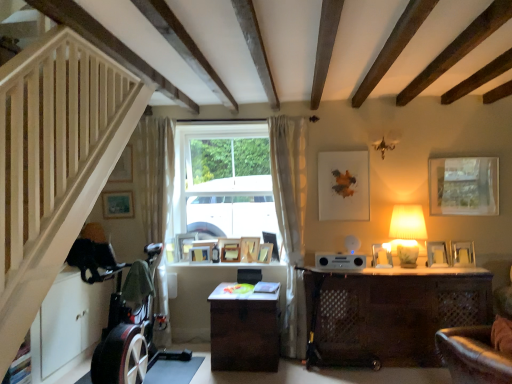
What do you see at coordinates (382, 255) in the screenshot? This screenshot has width=512, height=384. I see `matte silver picture frame at right, placed as the eighth picture frame when sorted from left to right` at bounding box center [382, 255].

Measure the distance between point (252, 260) and camera.

Point (252, 260) and camera are 14.62 feet apart from each other.

The height and width of the screenshot is (384, 512). Find the location of `wooden photo frame at center, the fifth picture frame in the right-to-left sequence`. wooden photo frame at center, the fifth picture frame in the right-to-left sequence is located at coordinates click(249, 249).

The image size is (512, 384). I want to click on matte gold picture frame at upper left, placed as the tenth picture frame when sorted from right to left, so click(123, 167).

The height and width of the screenshot is (384, 512). What do you see at coordinates (463, 254) in the screenshot? I see `metallic reflective picture frame at right, which is counted as the first picture frame, starting from the right` at bounding box center [463, 254].

The height and width of the screenshot is (384, 512). Describe the element at coordinates (389, 314) in the screenshot. I see `dark wood desk at center` at that location.

Image resolution: width=512 pixels, height=384 pixels. I want to click on white fabric lampshade at right, so click(x=407, y=232).

Where is `matte silver picture frame at right, placed as the eighth picture frame when sorted from left to right`? The image size is (512, 384). matte silver picture frame at right, placed as the eighth picture frame when sorted from left to right is located at coordinates (382, 255).

Does metallic reflective picture frame at right, positioned as the 10th picture frame in left-to-right order, have a lesser height compared to matte gold picture frame at upper left, positioned as the first picture frame in left-to-right order?

Yes, metallic reflective picture frame at right, positioned as the 10th picture frame in left-to-right order, is shorter than matte gold picture frame at upper left, positioned as the first picture frame in left-to-right order.

Measure the distance between metallic reflective picture frame at right, positioned as the 10th picture frame in left-to-right order, and matte gold picture frame at upper left, positioned as the first picture frame in left-to-right order.

A distance of 3.38 meters exists between metallic reflective picture frame at right, positioned as the 10th picture frame in left-to-right order, and matte gold picture frame at upper left, positioned as the first picture frame in left-to-right order.

Is metallic reflective picture frame at right, which is counted as the first picture frame, starting from the right, positioned with its back to matte gold picture frame at upper left, positioned as the first picture frame in left-to-right order?

No, matte gold picture frame at upper left, positioned as the first picture frame in left-to-right order, is not at the back of metallic reflective picture frame at right, which is counted as the first picture frame, starting from the right.

Considering the positions of points (459, 257) and (132, 168), is point (459, 257) closer to camera compared to point (132, 168)?

That is True.

Which picture frame is the 2nd one when counting from the back of the matte gold picture frame at upper left, positioned as the first picture frame in left-to-right order? Please provide its 2D coordinates.

[(249, 249)]

From a real-world perspective, is wooden photo frame at center, the 6th picture frame viewed from the left, under matte gold picture frame at upper left, placed as the tenth picture frame when sorted from right to left?

Yes.

Can you confirm if wooden photo frame at center, the fifth picture frame in the right-to-left sequence, is wider than matte gold picture frame at upper left, positioned as the first picture frame in left-to-right order?

Correct, the width of wooden photo frame at center, the fifth picture frame in the right-to-left sequence, exceeds that of matte gold picture frame at upper left, positioned as the first picture frame in left-to-right order.

Can you tell me how much wooden photo frame at center, the fifth picture frame in the right-to-left sequence, and matte gold picture frame at upper left, placed as the tenth picture frame when sorted from right to left, differ in facing direction?

wooden photo frame at center, the fifth picture frame in the right-to-left sequence, and matte gold picture frame at upper left, placed as the tenth picture frame when sorted from right to left, are facing 12.5 degrees away from each other.

Does point (201, 254) lie behind point (443, 247)?

Yes, point (201, 254) is behind point (443, 247).

Measure the distance between wooden picture frame at center, arranged as the 4th picture frame when viewed from the left, and silver metallic picture frame at right, positioned as the 9th picture frame in left-to-right order.

They are 2.28 meters apart.

Between wooden picture frame at center, arranged as the 4th picture frame when viewed from the left, and silver metallic picture frame at right, positioned as the 9th picture frame in left-to-right order, which one is positioned behind?

wooden picture frame at center, arranged as the 4th picture frame when viewed from the left.

Which object is positioned more to the left, wooden picture frame at center, placed as the seventh picture frame when sorted from right to left, or silver metallic picture frame at right, positioned as the 9th picture frame in left-to-right order?

wooden picture frame at center, placed as the seventh picture frame when sorted from right to left, is more to the left.

From the picture: Considering the sizes of objects silver metallic picture frame at right, positioned as the 9th picture frame in left-to-right order, and wooden picture frame at center, the fifth picture frame when ordered from left to right, in the image provided, who is bigger, silver metallic picture frame at right, positioned as the 9th picture frame in left-to-right order, or wooden picture frame at center, the fifth picture frame when ordered from left to right,?

Bigger between the two is silver metallic picture frame at right, positioned as the 9th picture frame in left-to-right order.

Is silver metallic picture frame at right, positioned as the 9th picture frame in left-to-right order, far away from wooden picture frame at center, which is counted as the 6th picture frame, starting from the right?

Yes, silver metallic picture frame at right, positioned as the 9th picture frame in left-to-right order, and wooden picture frame at center, which is counted as the 6th picture frame, starting from the right, are quite far apart.

Does silver metallic picture frame at right, positioned as the 9th picture frame in left-to-right order, have a greater height compared to wooden picture frame at center, which is counted as the 6th picture frame, starting from the right?

Correct, silver metallic picture frame at right, positioned as the 9th picture frame in left-to-right order, is much taller as wooden picture frame at center, which is counted as the 6th picture frame, starting from the right.

Is silver metallic picture frame at right, positioned as the 9th picture frame in left-to-right order, turned away from wooden picture frame at center, the fifth picture frame when ordered from left to right?

silver metallic picture frame at right, positioned as the 9th picture frame in left-to-right order, does not have its back to wooden picture frame at center, the fifth picture frame when ordered from left to right.

In the scene shown: How distant is wooden picture frame at center, which ranks as the 3th picture frame in left-to-right order, from dark wood desk at center?

They are 2.06 meters apart.

The width and height of the screenshot is (512, 384). In order to click on desk lying on the right of wooden picture frame at center, arranged as the 8th picture frame when viewed from the right in this screenshot , I will do `click(389, 314)`.

How many degrees apart are the facing directions of wooden picture frame at center, which ranks as the 3th picture frame in left-to-right order, and dark wood desk at center?

The facing directions of wooden picture frame at center, which ranks as the 3th picture frame in left-to-right order, and dark wood desk at center are 35.9 degrees apart.

Is wooden picture frame at center, which ranks as the 3th picture frame in left-to-right order, positioned far away from dark wood desk at center?

That's right, there is a large distance between wooden picture frame at center, which ranks as the 3th picture frame in left-to-right order, and dark wood desk at center.

Can you confirm if white fabric lampshade at right is positioned to the right of metallic reflective picture frame at right, positioned as the 10th picture frame in left-to-right order?

In fact, white fabric lampshade at right is to the left of metallic reflective picture frame at right, positioned as the 10th picture frame in left-to-right order.

Find the location of a particular element. Image resolution: width=512 pixels, height=384 pixels. the 3rd picture frame directly beneath the white fabric lampshade at right (from a real-world perspective) is located at coordinates (463, 254).

In the scene shown: Measure the distance between white fabric lampshade at right and metallic reflective picture frame at right, which is counted as the first picture frame, starting from the right.

white fabric lampshade at right and metallic reflective picture frame at right, which is counted as the first picture frame, starting from the right, are 18.00 inches apart.

Is white fabric lampshade at right far away from metallic reflective picture frame at right, which is counted as the first picture frame, starting from the right?

They are positioned close to each other.

Is wooden picture frame at center, arranged as the 4th picture frame when viewed from the left, at the back of brown woven table at center?

No, wooden picture frame at center, arranged as the 4th picture frame when viewed from the left, is not at the back of brown woven table at center.

Who is shorter, brown woven table at center or wooden picture frame at center, arranged as the 4th picture frame when viewed from the left?

With less height is wooden picture frame at center, arranged as the 4th picture frame when viewed from the left.

Which object is closer to the camera taking this photo, brown woven table at center or wooden picture frame at center, placed as the seventh picture frame when sorted from right to left?

Positioned in front is brown woven table at center.

Find the location of `the 6th picture frame in front when counting from the matte gold picture frame at upper left, placed as the tenth picture frame when sorted from right to left`. the 6th picture frame in front when counting from the matte gold picture frame at upper left, placed as the tenth picture frame when sorted from right to left is located at coordinates (463, 254).

Where is `the 5th picture frame to the right of the matte gold picture frame at upper left, positioned as the first picture frame in left-to-right order, starting your count from the anchor`? the 5th picture frame to the right of the matte gold picture frame at upper left, positioned as the first picture frame in left-to-right order, starting your count from the anchor is located at coordinates (249, 249).

Estimate the real-world distances between objects in this image. Which object is closer to matte gold picture frame at upper left, positioned as the first picture frame in left-to-right order, white sheer curtain at center, arranged as the first curtain when viewed from the right, or white sheer curtain at left, the 1th curtain viewed from the left?

Based on the image, white sheer curtain at left, the 1th curtain viewed from the left, appears to be nearer to matte gold picture frame at upper left, positioned as the first picture frame in left-to-right order.

Looking at the image, which one is located further to dark wood desk at center, wooden photo frame at center, the 6th picture frame viewed from the left, or wooden picture frame at center, which ranks as the 3th picture frame in left-to-right order?

Based on the image, wooden picture frame at center, which ranks as the 3th picture frame in left-to-right order, appears to be further to dark wood desk at center.

Considering their positions, is wooden picture frame at center, the fifth picture frame when ordered from left to right, positioned further to wooden stairwell at left than white sheer curtain at center, which is counted as the 2th curtain, starting from the left?

wooden picture frame at center, the fifth picture frame when ordered from left to right, is positioned further to the anchor wooden stairwell at left.

Looking at the image, which one is located closer to wooden picture frame at center, arranged as the 4th picture frame when viewed from the left, wooden picture frame at center, the 4th picture frame in the right-to-left sequence, or white sheer curtain at center, which is counted as the 2th curtain, starting from the left?

wooden picture frame at center, the 4th picture frame in the right-to-left sequence, is positioned closer to the anchor wooden picture frame at center, arranged as the 4th picture frame when viewed from the left.

Looking at the image, which one is located closer to dark wood desk at center, matte silver picture frame at right, the 3th picture frame in the right-to-left sequence, or wooden picture frame at center, placed as the seventh picture frame when sorted from right to left?

Based on the image, matte silver picture frame at right, the 3th picture frame in the right-to-left sequence, appears to be nearer to dark wood desk at center.

Estimate the real-world distances between objects in this image. Which object is further from brown woven table at center, silver metallic picture frame at right, positioned as the 9th picture frame in left-to-right order, or white fabric lampshade at right?

silver metallic picture frame at right, positioned as the 9th picture frame in left-to-right order, is positioned further to the anchor brown woven table at center.

Consider the image. Based on their spatial positions, is wooden picture frame at center, arranged as the 4th picture frame when viewed from the left, or silver metallic picture frame at right, positioned as the 9th picture frame in left-to-right order, closer to white fabric lampshade at right?

Among the two, silver metallic picture frame at right, positioned as the 9th picture frame in left-to-right order, is located nearer to white fabric lampshade at right.

Which object lies nearer to the anchor point wooden photo frame at center, the 6th picture frame viewed from the left, wooden picture frame at center, placed as the seventh picture frame when sorted from right to left, or wooden picture frame at center, the 4th picture frame in the right-to-left sequence?

wooden picture frame at center, the 4th picture frame in the right-to-left sequence, is closer to wooden photo frame at center, the 6th picture frame viewed from the left.

This screenshot has height=384, width=512. Identify the location of curtain between matte blue picture frame at lower left, acting as the 9th picture frame starting from the right, and wooden picture frame at center, placed as the seventh picture frame when sorted from right to left. (154, 175).

Identify the location of desk between wooden picture frame at center, the 4th picture frame in the right-to-left sequence, and metallic reflective picture frame at right, which is counted as the first picture frame, starting from the right. The width and height of the screenshot is (512, 384). pyautogui.click(x=389, y=314).

What are the coordinates of `table located between wooden picture frame at center, which is counted as the 6th picture frame, starting from the right, and dark wood desk at center in the left-right direction` in the screenshot? It's located at (244, 331).

Identify the location of curtain between brown woven table at center and matte silver picture frame at right, the 3th picture frame in the right-to-left sequence, in the horizontal direction. (290, 220).